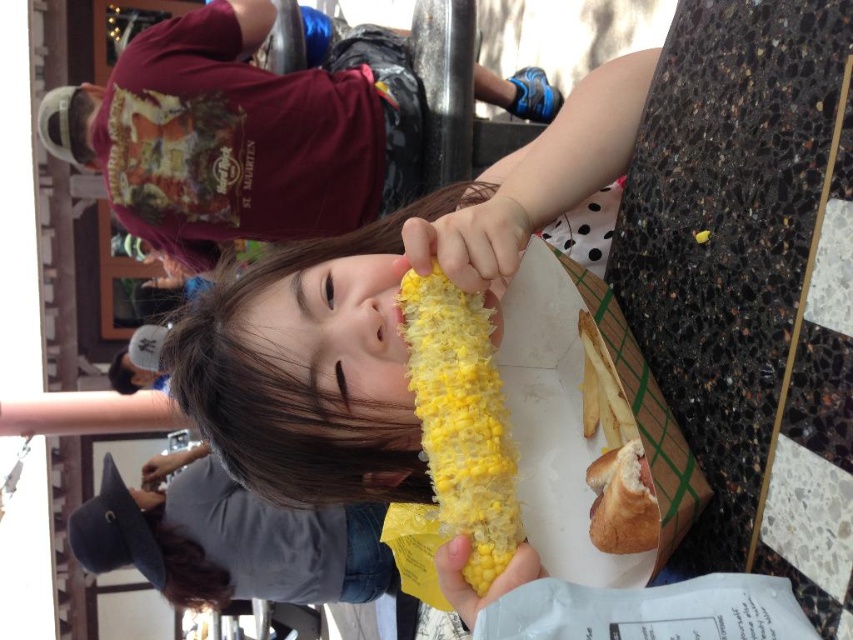
Measure the distance between yellow matte corn at center and golden bread hot dog at lower right.

yellow matte corn at center is 5.89 inches away from golden bread hot dog at lower right.

Describe the element at coordinates (462, 420) in the screenshot. I see `yellow matte corn at center` at that location.

Where is `yellow matte corn at center`? This screenshot has height=640, width=853. yellow matte corn at center is located at coordinates (462, 420).